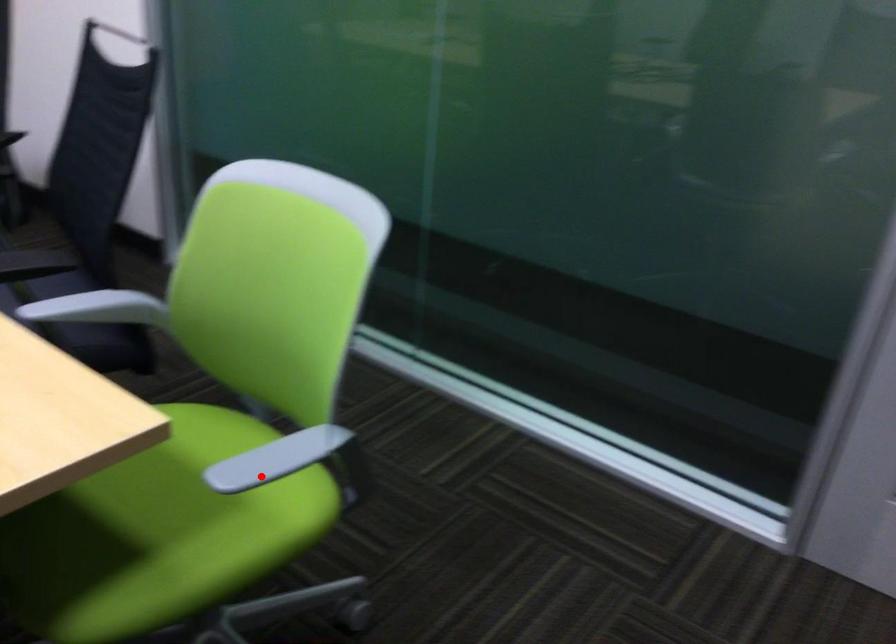
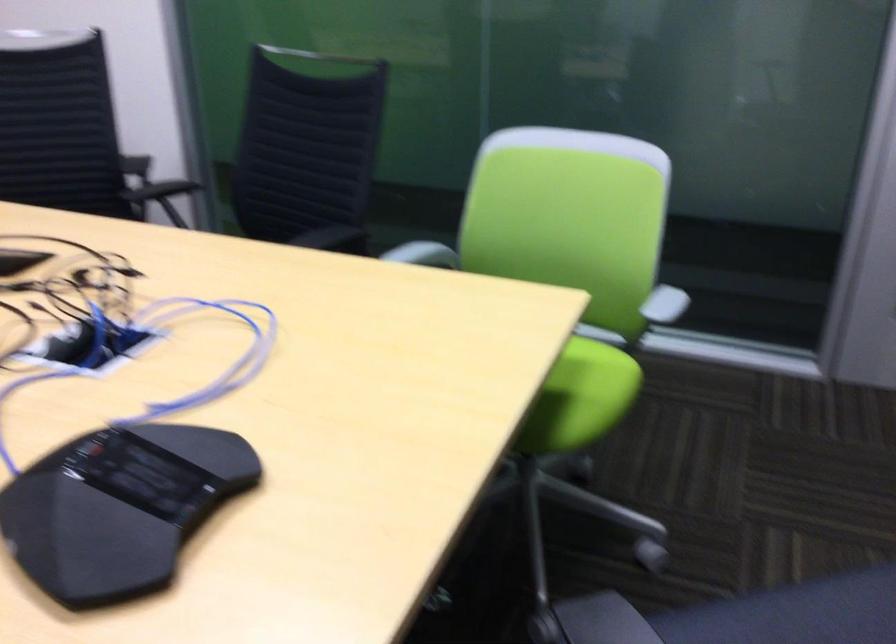
Question: A red point is marked in image1. In image2, is the corresponding 3D point closer to the camera or farther? Reply with the corresponding letter.

Choices:
 (A) The corresponding 3D point is closer.
 (B) The corresponding 3D point is farther.

Answer: (B)